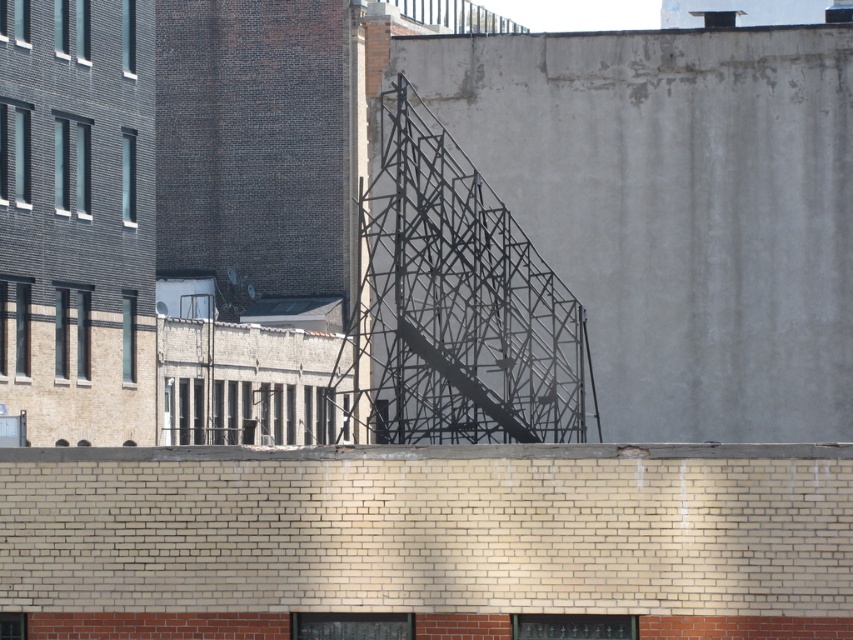
Between point (520, 356) and point (436, 358), which one is positioned in front?

Positioned in front is point (436, 358).

Between metallic scaffolding at center and metallic gray staircase at center, which one has less height?

Standing shorter between the two is metallic gray staircase at center.

Does point (503, 339) come behind point (468, 381)?

Yes, it is.

You are a GUI agent. You are given a task and a screenshot of the screen. Output one action in this format:
    pyautogui.click(x=<x>, y=<y>)
    Task: Click on the metallic scaffolding at center
    Image resolution: width=853 pixels, height=640 pixels.
    Given the screenshot: What is the action you would take?
    pyautogui.click(x=453, y=305)